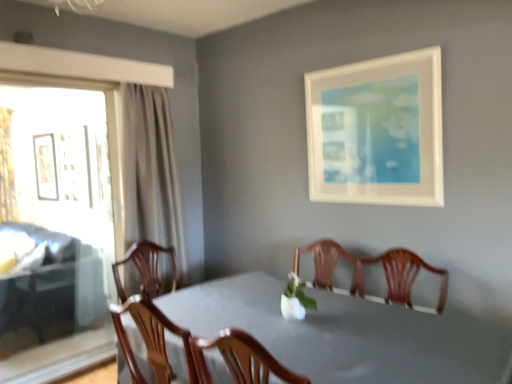
You are a GUI agent. You are given a task and a screenshot of the screen. Output one action in this format:
    pyautogui.click(x=<x>, y=<y>)
    Task: Click on the vacant region above white matte picture frame at upper right, acting as the 2th picture frame starting from the left (from a real-world perspective)
    The height and width of the screenshot is (384, 512).
    Given the screenshot: What is the action you would take?
    pyautogui.click(x=377, y=52)